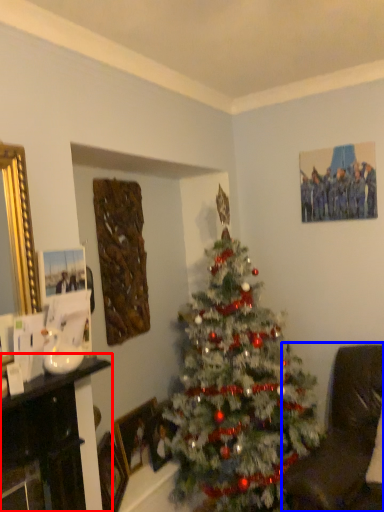
Question: Which object appears farthest to the camera in this image, furniture (highlighted by a red box) or rocking chair (highlighted by a blue box)?

Choices:
 (A) furniture
 (B) rocking chair

Answer: (A)